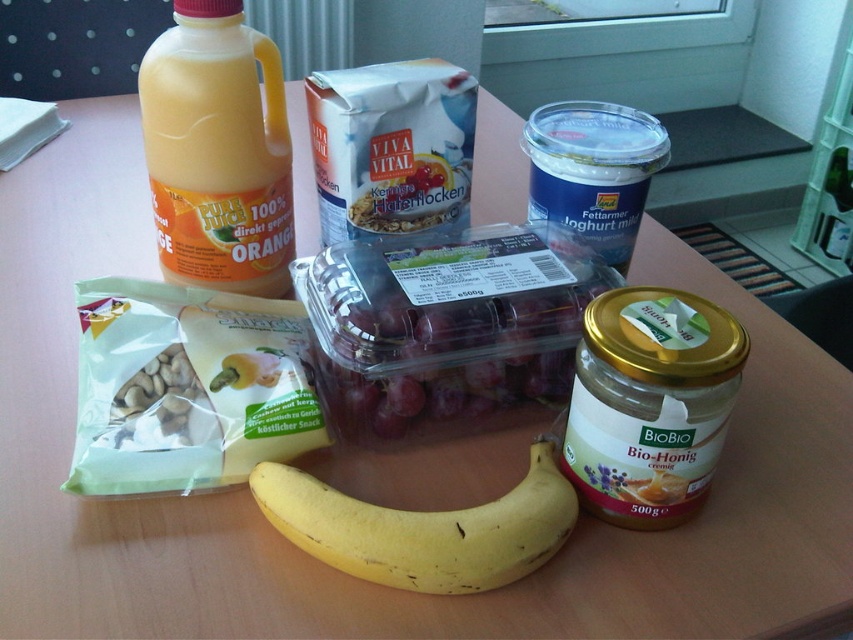
You are planning to pack a lunchbox and need to know which item is smaller between the yellow matte banana at center and the blue plastic yogurt at upper center. Which one should you choose if you want the smaller one?

The yellow matte banana at center is smaller compared to the blue plastic yogurt at upper center, so you should choose the yellow matte banana at center.

You are a chef preparing a fruit platter and need to place the yellow matte banana at center on the table. Where exactly should you place it?

The yellow matte banana at center should be placed at point (424, 529) on the table.